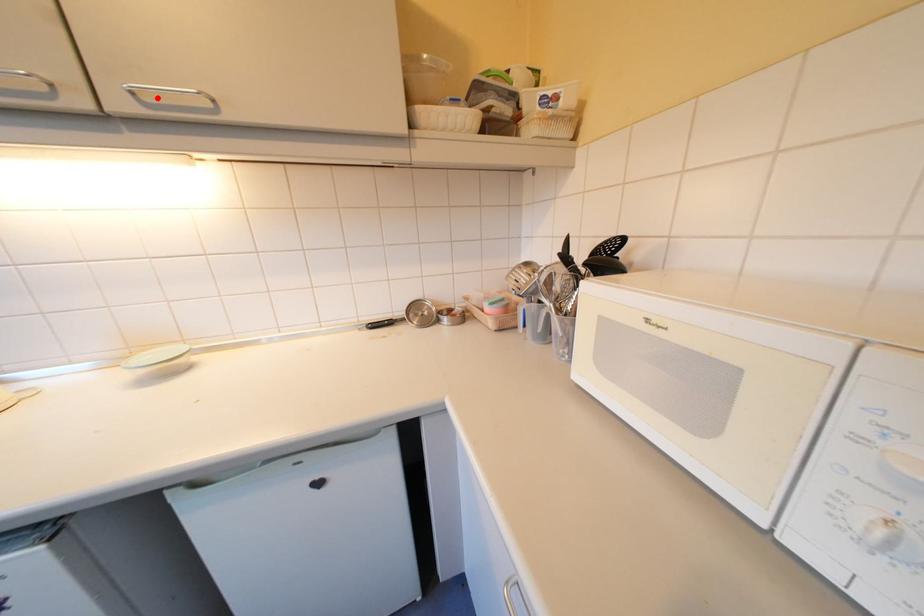
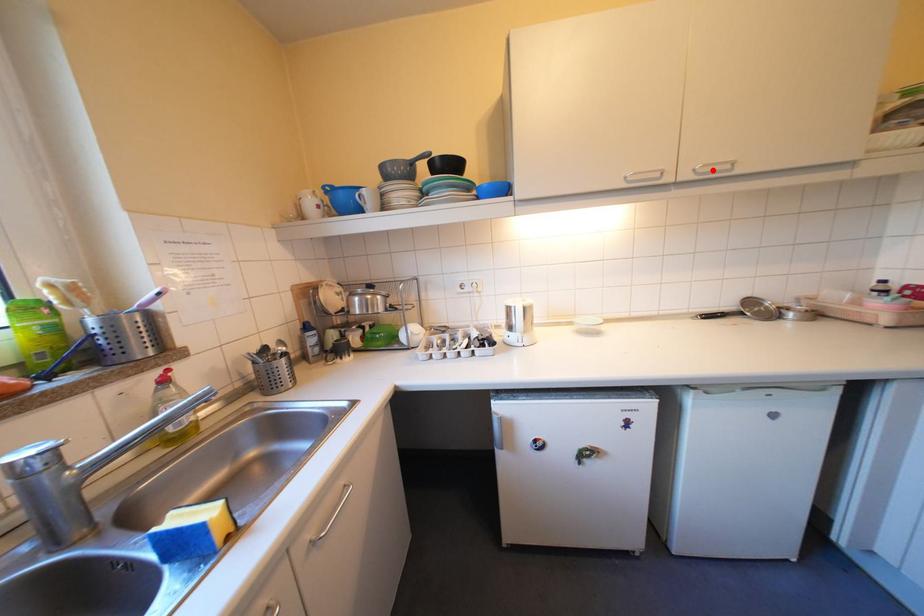
I am providing you with two images of the same scene from different viewpoints. A red point is marked on the first image and another point is marked on the second image. Does the point marked in image1 correspond to the same location as the one in image2?

Yes